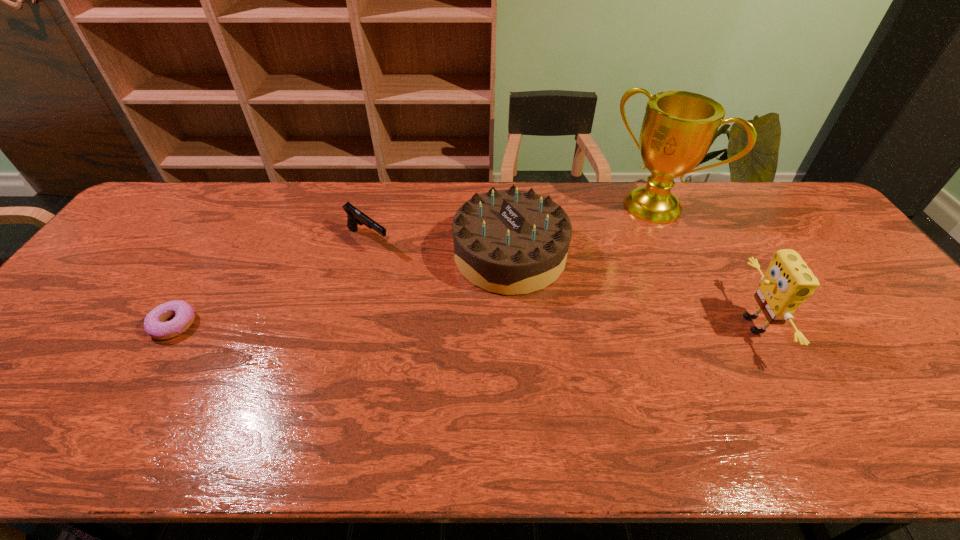
Identify the location of free space between the fourth shortest object and the second object from left to right. The image size is (960, 540). (560, 282).

Locate an element on the screen. The image size is (960, 540). vacant area that lies between the doughnut and the second tallest object is located at coordinates (463, 325).

The width and height of the screenshot is (960, 540). Identify the location of free spot between the gun and the leftmost object. (271, 282).

Identify the location of free spot between the doughnut and the third shortest object. (342, 289).

I want to click on free space between the second object from left to right and the shortest object, so click(271, 282).

This screenshot has width=960, height=540. I want to click on free spot between the award and the doughnut, so pyautogui.click(x=414, y=266).

This screenshot has width=960, height=540. In order to click on empty space that is in between the birthday cake and the second object from left to right in this screenshot , I will do coord(439,247).

Identify the location of the second closest object to the award. (788, 282).

Select which object is the third closest to the doughnut. Please provide its 2D coordinates. Your answer should be formatted as a tuple, i.e. [(x, y)], where the tuple contains the x and y coordinates of a point satisfying the conditions above.

[(678, 128)]

At what (x,y) coordinates should I click in order to perform the action: click on vacant space that satisfies the following two spatial constraints: 1. on the back side of the third object from right to left; 2. on the left side of the leftmost object. Please return your answer as a coordinate pair (x, y). This screenshot has width=960, height=540. Looking at the image, I should click on (216, 255).